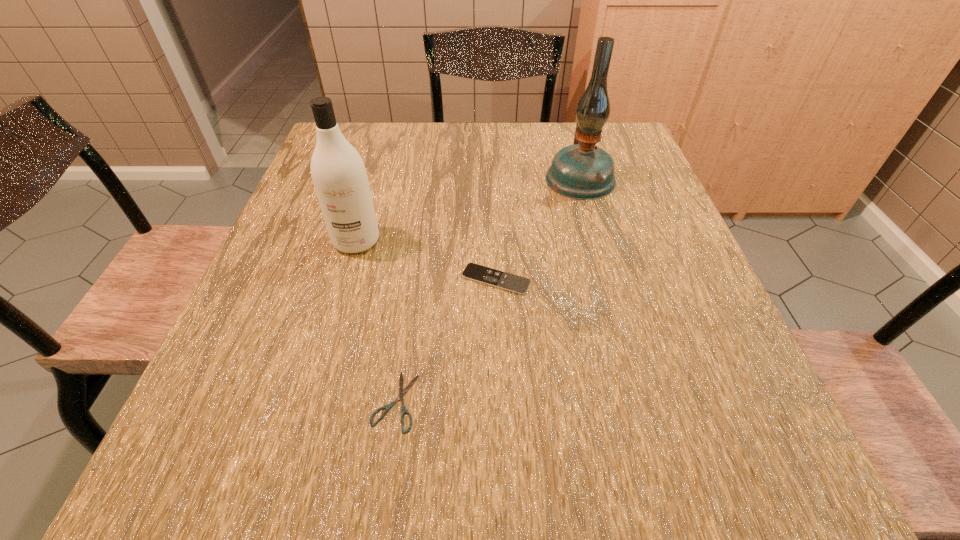
Where is `free space located 0.090m on the left of the remote control`? free space located 0.090m on the left of the remote control is located at coordinates (417, 280).

At what (x,y) coordinates should I click in order to perform the action: click on vacant space located on the right of the second object from left to right. Please return your answer as a coordinate pair (x, y). The height and width of the screenshot is (540, 960). Looking at the image, I should click on (500, 401).

I want to click on object that is at the far edge, so click(x=583, y=171).

Identify the location of object that is at the left edge. The height and width of the screenshot is (540, 960). (338, 172).

The image size is (960, 540). What are the coordinates of `object that is at the right edge` in the screenshot? It's located at (583, 171).

What are the coordinates of `object located at the far right corner` in the screenshot? It's located at (583, 171).

Where is `free region at the far edge of the desktop`? free region at the far edge of the desktop is located at coordinates (441, 131).

Locate an element on the screen. This screenshot has height=540, width=960. free location at the near edge is located at coordinates (540, 446).

At what (x,y) coordinates should I click in order to perform the action: click on vacant area at the right edge of the desktop. Please return your answer as a coordinate pair (x, y). Image resolution: width=960 pixels, height=540 pixels. Looking at the image, I should click on (632, 276).

Find the location of `vacant area at the far right corner of the desktop`. vacant area at the far right corner of the desktop is located at coordinates (636, 143).